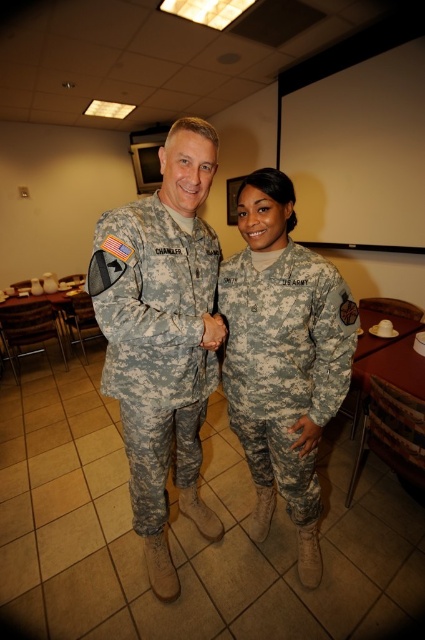
Question: From the image, what is the correct spatial relationship of camouflage uniform at center in relation to camouflage fabric uniform at center?

Choices:
 (A) below
 (B) above

Answer: (B)

Question: Among these points, which one is nearest to the camera?

Choices:
 (A) (150, 310)
 (B) (257, 337)
 (C) (308, 387)

Answer: (A)

Question: Is camouflage uniform at center wider than camouflage fabric uniform at center?

Choices:
 (A) no
 (B) yes

Answer: (B)

Question: Which point appears closest to the camera in this image?

Choices:
 (A) tap(124, 356)
 (B) tap(272, 317)
 (C) tap(286, 259)

Answer: (B)

Question: Which of the following is the closest to the observer?

Choices:
 (A) (308, 509)
 (B) (300, 275)
 (C) (164, 278)

Answer: (C)

Question: Is camouflage uniform at center to the right of digital camouflage uniform at center from the viewer's perspective?

Choices:
 (A) yes
 (B) no

Answer: (B)